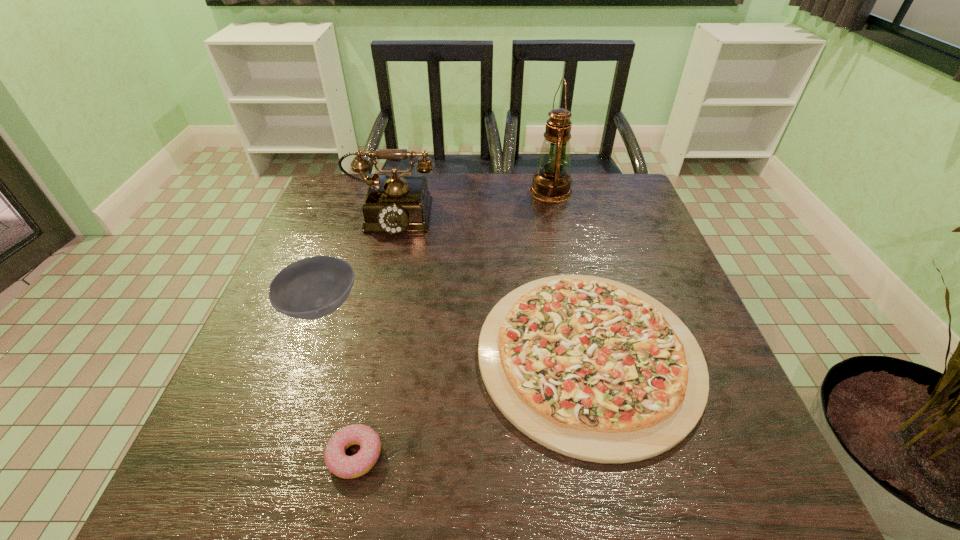
I want to click on vacant space that satisfies the following two spatial constraints: 1. on the dial of the telephone; 2. on the left side of the doughnut, so click(x=331, y=456).